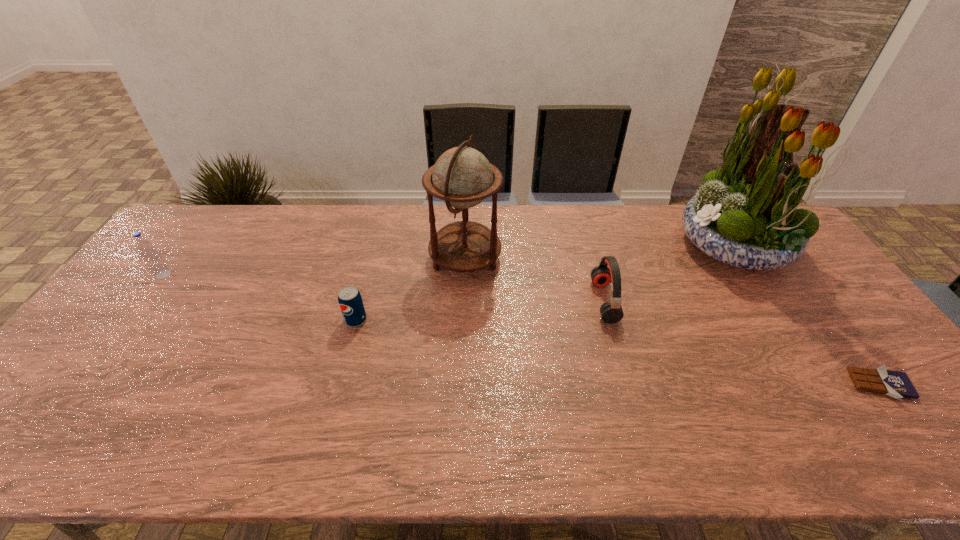
This screenshot has height=540, width=960. I want to click on vacant position located 0.350m on the front-facing side of the tallest object, so click(x=574, y=246).

Locate an element on the screen. Image resolution: width=960 pixels, height=540 pixels. vacant space located on the front-facing side of the tallest object is located at coordinates (637, 246).

The image size is (960, 540). Identify the location of free space located on the surface of the third object from left to right. (529, 258).

Find the location of a particular element. vacant space situated on the right of the water bottle is located at coordinates (297, 274).

Find the location of a particular element. free region located on the ear cups of the earphone is located at coordinates (498, 301).

Locate an element on the screen. The width and height of the screenshot is (960, 540). free space located 0.190m on the ear cups of the earphone is located at coordinates (529, 301).

The image size is (960, 540). I want to click on vacant point located on the ear cups of the earphone, so click(x=474, y=301).

At what (x,y) coordinates should I click in order to perform the action: click on free region located 0.260m on the back of the pop. Please return your answer as a coordinate pair (x, y). The width and height of the screenshot is (960, 540). Looking at the image, I should click on (373, 252).

Find the location of a particular element. blank area located 0.100m on the front of the shortest object is located at coordinates (924, 443).

Where is `flower arrangement that is at the far edge`? flower arrangement that is at the far edge is located at coordinates (746, 215).